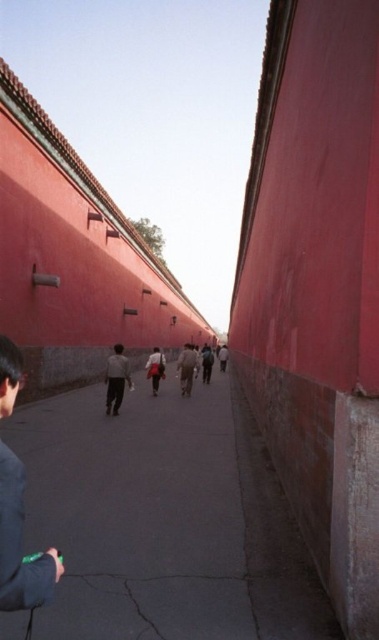
Which is more to the right, light gray fabric jacket at center or light brown fabric jacket at center?

light brown fabric jacket at center

Does light gray fabric jacket at center have a greater width compared to light brown fabric jacket at center?

Indeed, light gray fabric jacket at center has a greater width compared to light brown fabric jacket at center.

What do you see at coordinates (115, 380) in the screenshot? I see `light gray fabric jacket at center` at bounding box center [115, 380].

Find the location of a particular element. The image size is (379, 640). light gray fabric jacket at center is located at coordinates (115, 380).

I want to click on concrete pavement at center, so [164, 518].

Is concrete pavement at center below light gray fabric jacket at center?

Yes, concrete pavement at center is below light gray fabric jacket at center.

Describe the element at coordinates (164, 518) in the screenshot. The height and width of the screenshot is (640, 379). I see `concrete pavement at center` at that location.

This screenshot has width=379, height=640. In order to click on concrete pavement at center in this screenshot , I will do `click(164, 518)`.

Who is positioned more to the left, light gray fabric jacket at center or dark brown leather jacket at center?

light gray fabric jacket at center

Between light gray fabric jacket at center and dark brown leather jacket at center, which one is positioned higher?

light gray fabric jacket at center is higher up.

At what (x,y) coordinates should I click in order to perform the action: click on light gray fabric jacket at center. Please return your answer as a coordinate pair (x, y). This screenshot has height=640, width=379. Looking at the image, I should click on (115, 380).